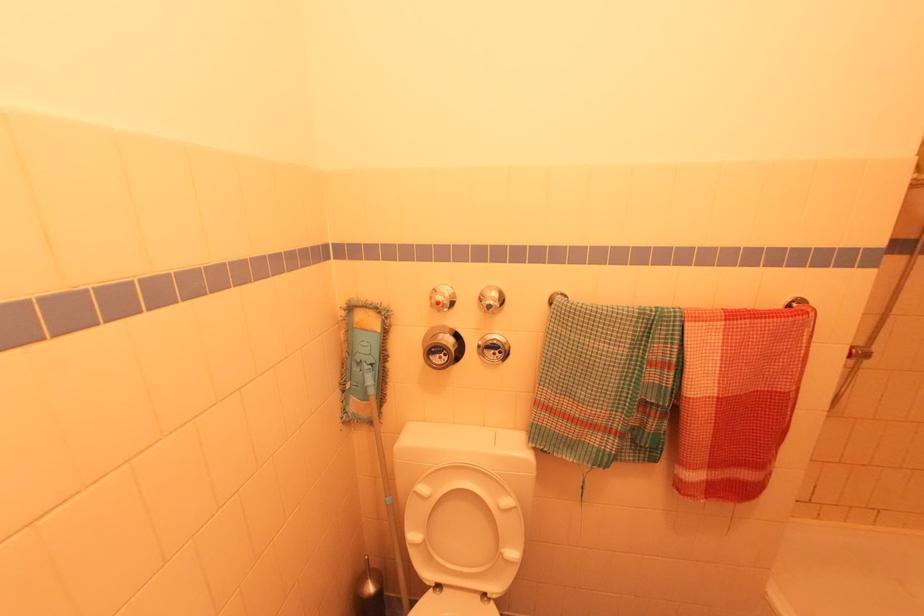
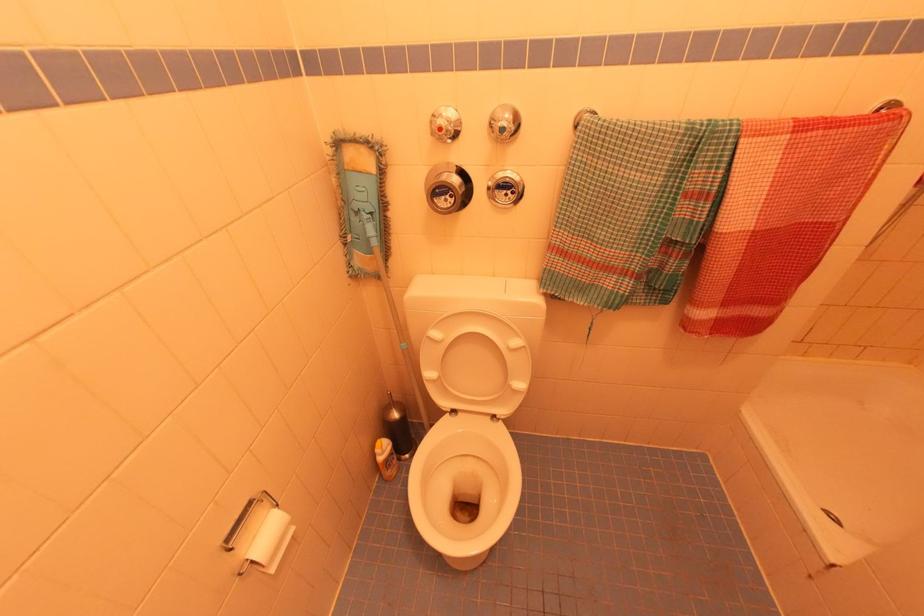
In the second image, find the point that corresponds to point 502,353 in the first image.

(515, 193)